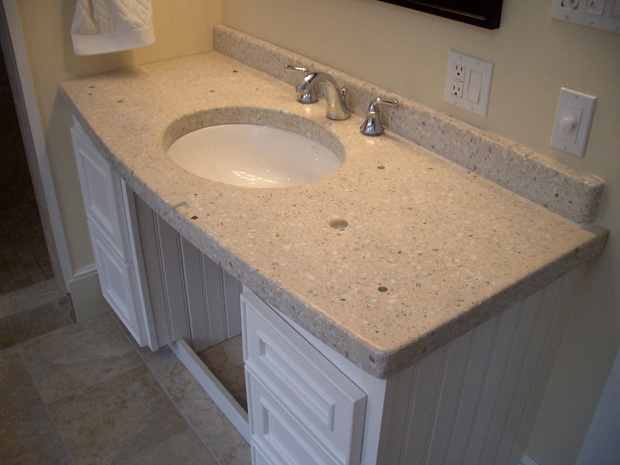
You are a GUI agent. You are given a task and a screenshot of the screen. Output one action in this format:
    pyautogui.click(x=<x>, y=<y>)
    Task: Click on the sink water controls
    Image resolution: width=620 pixels, height=465 pixels.
    Given the screenshot: What is the action you would take?
    pyautogui.click(x=369, y=120), pyautogui.click(x=298, y=70)